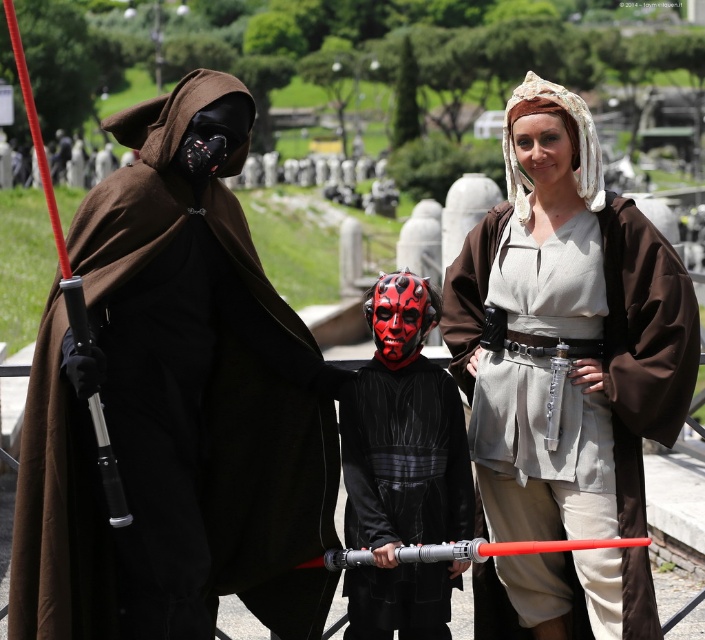
You are a costume designer trying to adjust the visibility of the matte brown robe at center and the black velvet robe at center for a photo shoot. Which robe should you focus on moving forward to ensure both are visible in the photo?

The matte brown robe at center is positioned over the black velvet robe at center, so you should move the matte brown robe at center slightly backward to prevent it from blocking the black velvet robe at center in the photo.

You are a photographer at the Star Wars event. You need to capture a photo where both the brown matte robe at left and the matte brown robe at center are visible. Based on their positions, which robe should you ensure is closer to the camera to include both in the frame?

The brown matte robe at left is located above the matte brown robe at center, so to include both in the frame, ensure the brown matte robe at left is closer to the camera.